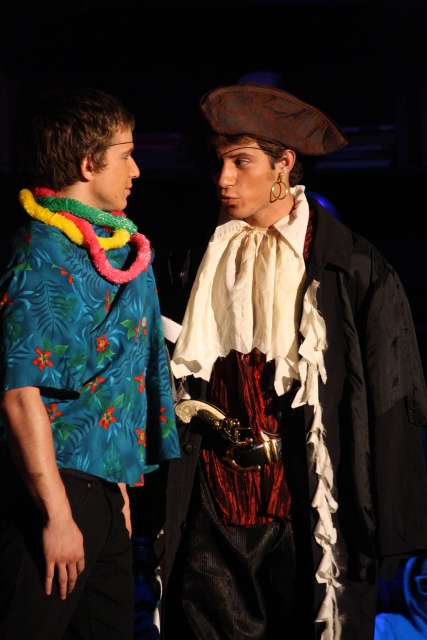
Is rusty metal pirate hat at upper center further to camera compared to teal floral shirt at left?

Yes, it is behind teal floral shirt at left.

Does point (301, 522) come closer to viewer compared to point (32, 369)?

No, it is not.

Describe the element at coordinates (290, 397) in the screenshot. I see `rusty metal pirate hat at upper center` at that location.

At what (x,y) coordinates should I click in order to perform the action: click on rusty metal pirate hat at upper center. Please return your answer as a coordinate pair (x, y). The height and width of the screenshot is (640, 427). Looking at the image, I should click on (290, 397).